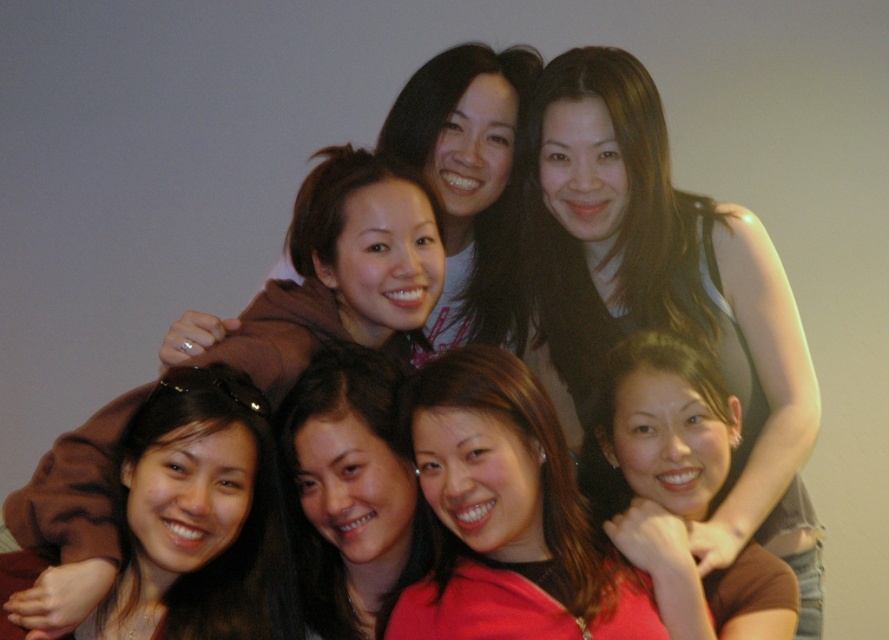
Is matte red shirt at center further to the viewer compared to matte brown shirt at center?

That is False.

Does matte red shirt at center appear on the right side of matte brown shirt at center?

No, matte red shirt at center is not to the right of matte brown shirt at center.

Who is more distant from viewer, (405, 605) or (697, 460)?

Positioned behind is point (697, 460).

Where is `matte red shirt at center`? matte red shirt at center is located at coordinates (507, 516).

Can you confirm if matte black tank top at upper right is smaller than matte brown shirt at center?

Incorrect, matte black tank top at upper right is not smaller in size than matte brown shirt at center.

Who is positioned more to the right, matte black tank top at upper right or matte brown shirt at center?

From the viewer's perspective, matte brown shirt at center appears more on the right side.

Does point (631, 202) lie behind point (618, 515)?

Yes.

Image resolution: width=889 pixels, height=640 pixels. Identify the location of matte black tank top at upper right. (666, 298).

How distant is matte brown shirt at center from smooth brown hair at center?

A distance of 17.47 inches exists between matte brown shirt at center and smooth brown hair at center.

In the scene shown: Who is more distant from viewer, (671, 529) or (333, 388)?

The point (333, 388) is behind.

Is point (611, 440) more distant than point (284, 465)?

Yes, it is.

This screenshot has width=889, height=640. In order to click on matte brown shirt at center in this screenshot , I will do `click(683, 490)`.